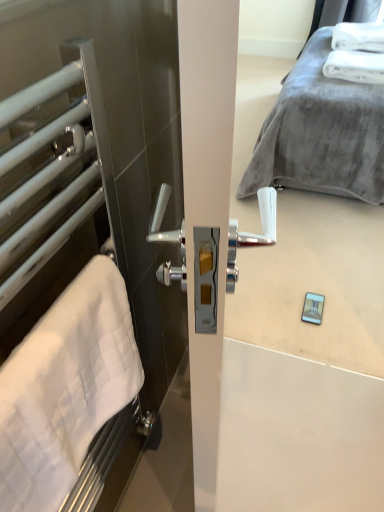
Question: Would you say white soft towel at upper right, the 1th bath towel positioned from the right, is inside or outside white matte towel rack at left?

Choices:
 (A) outside
 (B) inside

Answer: (A)

Question: In terms of height, does white soft towel at upper right, positioned as the first bath towel in back-to-front order, look taller or shorter compared to white matte towel rack at left?

Choices:
 (A) short
 (B) tall

Answer: (A)

Question: Considering the real-world distances, which object is farthest from the white soft towel at upper right, the 2th bath towel ordered from the bottom?

Choices:
 (A) white soft towel at left, the second bath towel in the top-to-bottom sequence
 (B) white matte towel rack at left
 (C) velvet gray bed at upper right

Answer: (A)

Question: Considering the real-world distances, which object is closest to the white soft towel at upper right, arranged as the second bath towel when viewed from the front?

Choices:
 (A) white matte towel rack at left
 (B) white soft towel at left, positioned as the second bath towel in right-to-left order
 (C) velvet gray bed at upper right

Answer: (C)